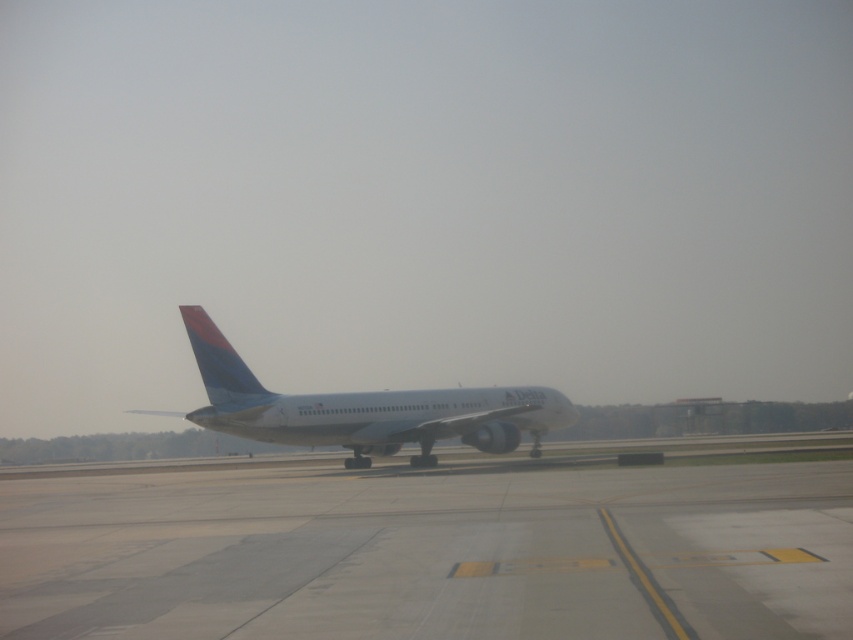
Is gray concrete tarmac at center below white glossy airplane at center?

No, gray concrete tarmac at center is not below white glossy airplane at center.

At what (x,y) coordinates should I click in order to perform the action: click on gray concrete tarmac at center. Please return your answer as a coordinate pair (x, y). The height and width of the screenshot is (640, 853). Looking at the image, I should click on (430, 552).